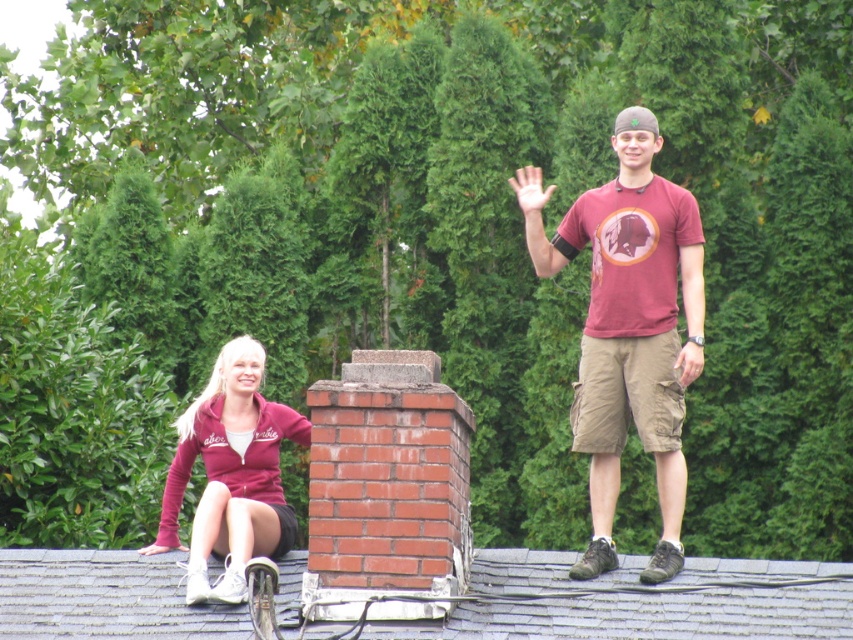
Can you confirm if matte red t-shirt at center is positioned to the left of maroon fleece jacket at lower left?

No, matte red t-shirt at center is not to the left of maroon fleece jacket at lower left.

Can you confirm if matte red t-shirt at center is positioned below maroon fleece jacket at lower left?

Incorrect, matte red t-shirt at center is not positioned below maroon fleece jacket at lower left.

Between point (664, 365) and point (258, 520), which one is positioned behind?

Positioned behind is point (664, 365).

Identify the location of matte red t-shirt at center. (628, 328).

Is gray shingles at center shorter than maroon fleece jacket at lower left?

Indeed, gray shingles at center has a lesser height compared to maroon fleece jacket at lower left.

Between point (548, 625) and point (148, 548), which one is positioned behind?

Point (148, 548)

Locate an element on the screen. The width and height of the screenshot is (853, 640). gray shingles at center is located at coordinates (624, 605).

Who is higher up, gray shingles at center or matte red t-shirt at center?

matte red t-shirt at center is higher up.

Is point (477, 636) more distant than point (676, 212)?

No, (477, 636) is in front of (676, 212).

You are a GUI agent. You are given a task and a screenshot of the screen. Output one action in this format:
    pyautogui.click(x=<x>, y=<y>)
    Task: Click on the gray shingles at center
    Image resolution: width=853 pixels, height=640 pixels.
    Given the screenshot: What is the action you would take?
    pyautogui.click(x=624, y=605)

The image size is (853, 640). Identify the location of gray shingles at center. (624, 605).